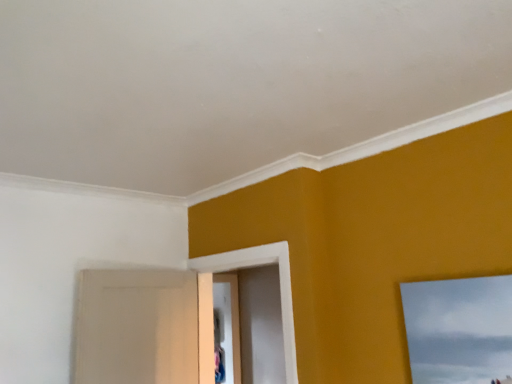
Locate an element on the screen. The width and height of the screenshot is (512, 384). white matte door at center is located at coordinates (279, 285).

Describe the element at coordinates (279, 285) in the screenshot. I see `white matte door at center` at that location.

This screenshot has height=384, width=512. I want to click on white matte door at center, so click(279, 285).